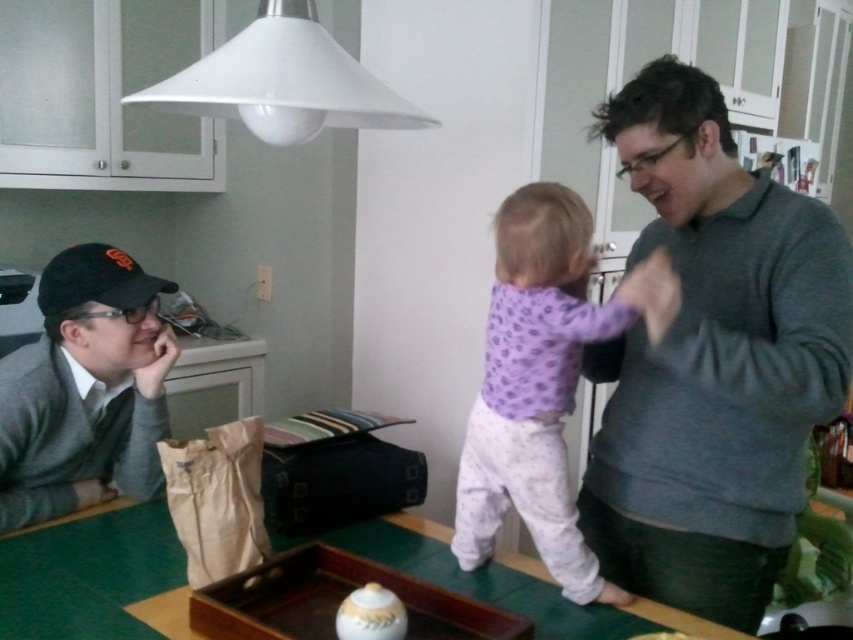
Which is in front, point (816, 339) or point (222, 528)?

Positioned in front is point (816, 339).

Identify the location of gray sweater at right. (711, 358).

Does green wooden table at center appear on the left side of brown paper bag at lower left?

Incorrect, green wooden table at center is not on the left side of brown paper bag at lower left.

I want to click on green wooden table at center, so click(x=88, y=573).

Who is more distant from viewer, (523, 604) or (216, 483)?

The point (216, 483) is behind.

Locate an element on the screen. green wooden table at center is located at coordinates (88, 573).

Who is taller, purple cotton shirt at center or brown paper bag at lower left?

purple cotton shirt at center

Which is more to the right, purple cotton shirt at center or brown paper bag at lower left?

purple cotton shirt at center is more to the right.

Identify the location of purple cotton shirt at center. (538, 384).